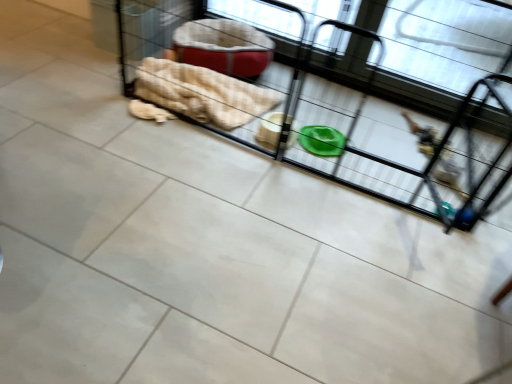
Find the location of a particular element. This screenshot has height=384, width=512. vacant space underneath green plastic bowl at center (from a real-world perspective) is located at coordinates (331, 138).